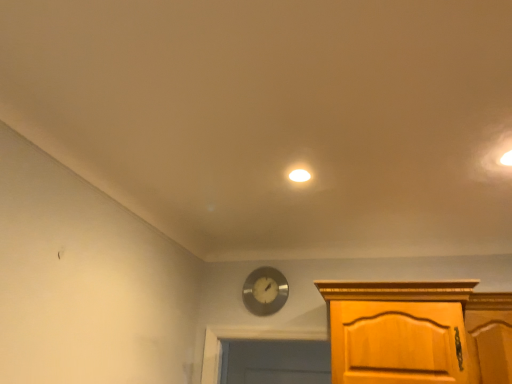
Question: From a real-world perspective, is metallic silver clock at center above or below white matte light fixture at center?

Choices:
 (A) below
 (B) above

Answer: (A)

Question: Is point (262, 301) positioned closer to the camera than point (295, 175)?

Choices:
 (A) farther
 (B) closer

Answer: (A)

Question: Considering the positions of metallic silver clock at center and white matte light fixture at center in the image, is metallic silver clock at center taller or shorter than white matte light fixture at center?

Choices:
 (A) short
 (B) tall

Answer: (B)

Question: Considering the positions of white matte light fixture at center and metallic silver clock at center in the image, is white matte light fixture at center taller or shorter than metallic silver clock at center?

Choices:
 (A) tall
 (B) short

Answer: (B)

Question: Relative to metallic silver clock at center, is white matte light fixture at center in front or behind?

Choices:
 (A) behind
 (B) front

Answer: (B)

Question: From the image's perspective, is white matte light fixture at center above or below metallic silver clock at center?

Choices:
 (A) below
 (B) above

Answer: (B)

Question: In terms of width, does white matte light fixture at center look wider or thinner when compared to metallic silver clock at center?

Choices:
 (A) thin
 (B) wide

Answer: (B)